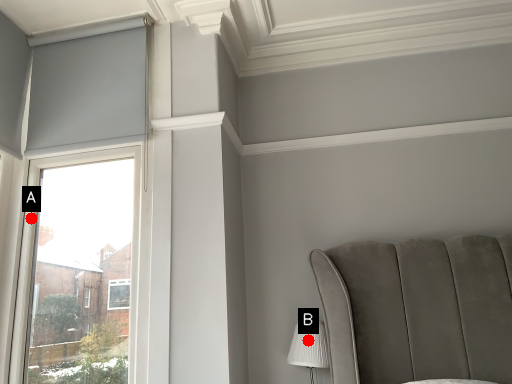
Question: Two points are circled on the image, labeled by A and B beside each circle. Which point is closer to the camera?

Choices:
 (A) A is closer
 (B) B is closer

Answer: (B)